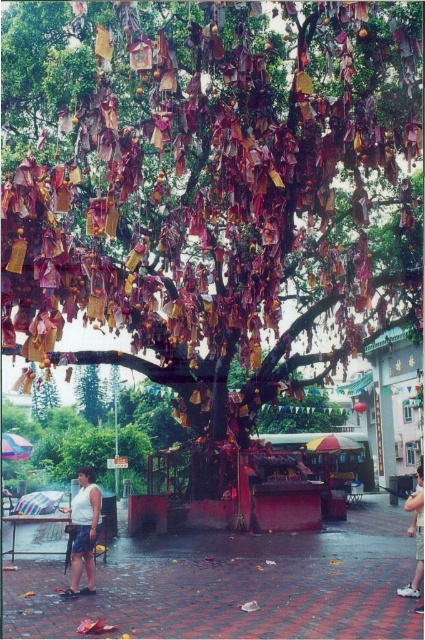
You are a fashion designer observing the scene and want to create a new outfit using the white matte tank top at lower center and the skinny jeans at lower right. Which item has a slimmer silhouette according to the description?

The white matte tank top at lower center has a slimmer silhouette than the skinny jeans at lower right because it is described as thinner.

Based on the photo, you are a photographer trying to capture a closeup of the white matte tank top at lower center and the skinny jeans at lower right. Since you want both items in the frame, which direction should you move your camera to ensure both are visible?

The white matte tank top at lower center is to the left of the skinny jeans at lower right. To include both in the frame, move the camera to the right so that both the left and right positions of the objects are within the camera view.

You are a photographer standing in front of the tree with the white matte tank top at lower center and the skinny jeans at lower right in your viewfinder. Which item should you focus on first if you want to capture both in a single shot without moving the camera?

You should focus on the white matte tank top at lower center first because it is above the skinny jeans at lower right, so it will be closer to the camera and easier to capture in the frame.